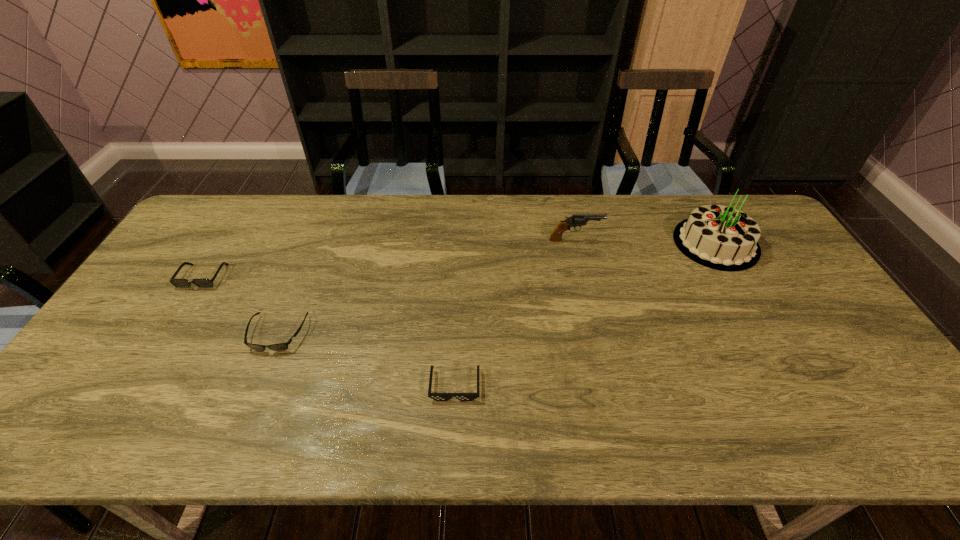
In the image, there is a desktop. Identify the location of blank space at the near edge. (292, 443).

Locate an element on the screen. vacant region at the left edge of the desktop is located at coordinates (171, 261).

Identify the location of free region at the far right corner of the desktop. (751, 208).

The width and height of the screenshot is (960, 540). I want to click on free space between the second nearest sunglasses and the rightmost object, so click(496, 288).

Locate an element on the screen. The height and width of the screenshot is (540, 960). vacant area that lies between the farthest sunglasses and the tallest object is located at coordinates (459, 260).

Locate an element on the screen. This screenshot has width=960, height=540. free space between the second nearest object and the leftmost object is located at coordinates (240, 305).

Locate an element on the screen. The height and width of the screenshot is (540, 960). free space between the second sunglasses from left to right and the second tallest object is located at coordinates (426, 287).

What are the coordinates of `free space between the rightmost sunglasses and the leftmost object` in the screenshot? It's located at (329, 330).

Locate an element on the screen. The width and height of the screenshot is (960, 540). unoccupied position between the tallest object and the rightmost sunglasses is located at coordinates [x=586, y=314].

Find the location of `vacant space that is in between the birthday cake and the farthest sunglasses`. vacant space that is in between the birthday cake and the farthest sunglasses is located at coordinates (459, 260).